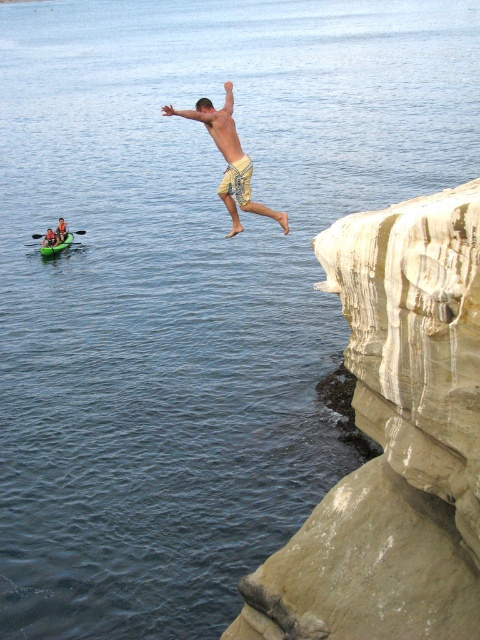
Question: Does tan textured shorts at upper center appear over green plastic paddle at left?

Choices:
 (A) no
 (B) yes

Answer: (A)

Question: Does tan textured shorts at upper center appear on the left side of green plastic paddle at left?

Choices:
 (A) no
 (B) yes

Answer: (B)

Question: Which of these objects is positioned farthest from the light beige rock at right?

Choices:
 (A) tan textured shorts at upper center
 (B) yellow striped shorts at center
 (C) green plastic paddle at left
 (D) green plastic kayak at left

Answer: (C)

Question: Which object is the farthest from the tan textured shorts at center?

Choices:
 (A) green plastic kayak at left
 (B) light beige rock at right

Answer: (B)

Question: Which point is closer to the camera?

Choices:
 (A) (48, 244)
 (B) (226, 161)
 (C) (38, 236)
 (D) (47, 250)

Answer: (B)

Question: Is the position of light beige rock at right less distant than that of tan textured shorts at upper center?

Choices:
 (A) no
 (B) yes

Answer: (B)